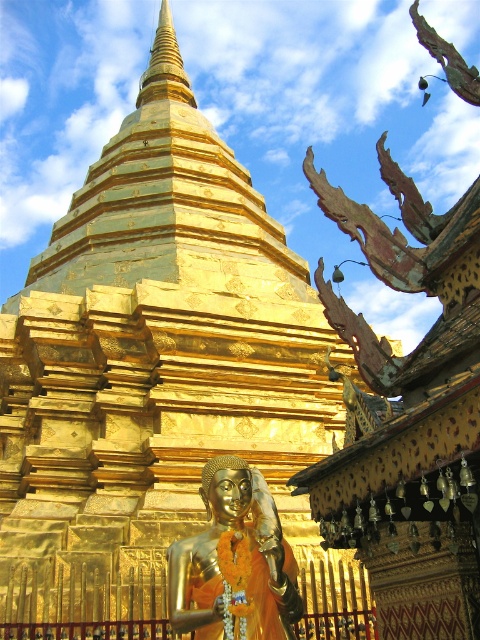
Question: Is gold metallic statue at center smaller than gold polished spire at upper center?

Choices:
 (A) no
 (B) yes

Answer: (B)

Question: Which point is closer to the camera?

Choices:
 (A) gold metallic statue at center
 (B) gold polished spire at upper center

Answer: (A)

Question: Does gold metallic statue at center have a greater width compared to gold polished spire at upper center?

Choices:
 (A) no
 (B) yes

Answer: (A)

Question: Which of the following is the closest to the observer?

Choices:
 (A) (156, 54)
 (B) (285, 608)

Answer: (B)

Question: Does gold metallic statue at center appear under gold polished spire at upper center?

Choices:
 (A) no
 (B) yes

Answer: (B)

Question: Which object is closer to the camera taking this photo?

Choices:
 (A) gold metallic statue at center
 (B) gold polished spire at upper center

Answer: (A)